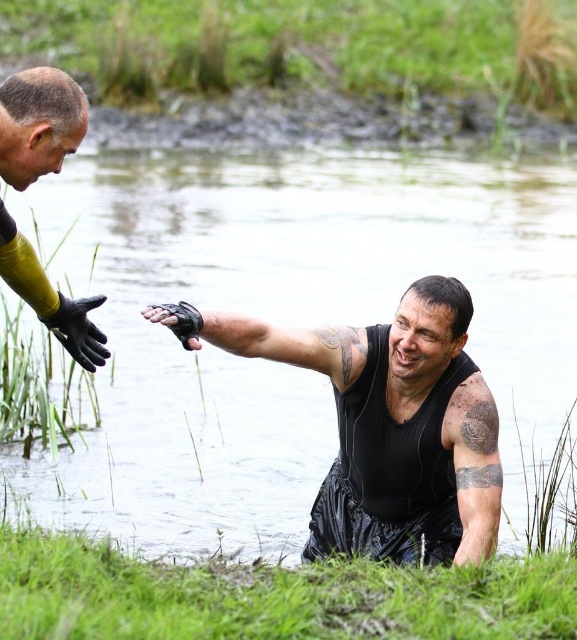
Is black matte vest at center shorter than black leather glove at center?

No, black matte vest at center is not shorter than black leather glove at center.

Where is `black matte vest at center`? The width and height of the screenshot is (577, 640). black matte vest at center is located at coordinates (392, 413).

Does clear water at center come in front of black matte vest at center?

That is False.

Can you confirm if clear water at center is shorter than black matte vest at center?

In fact, clear water at center may be taller than black matte vest at center.

This screenshot has height=640, width=577. In order to click on clear water at center in this screenshot , I will do `click(286, 323)`.

In order to click on clear water at center in this screenshot , I will do `click(286, 323)`.

Between point (370, 515) and point (95, 346), which one is positioned in front?

Point (95, 346) is in front.

Does point (355, 483) come closer to viewer compared to point (84, 358)?

No, it is behind (84, 358).

Identify the location of black matte vest at center. (392, 413).